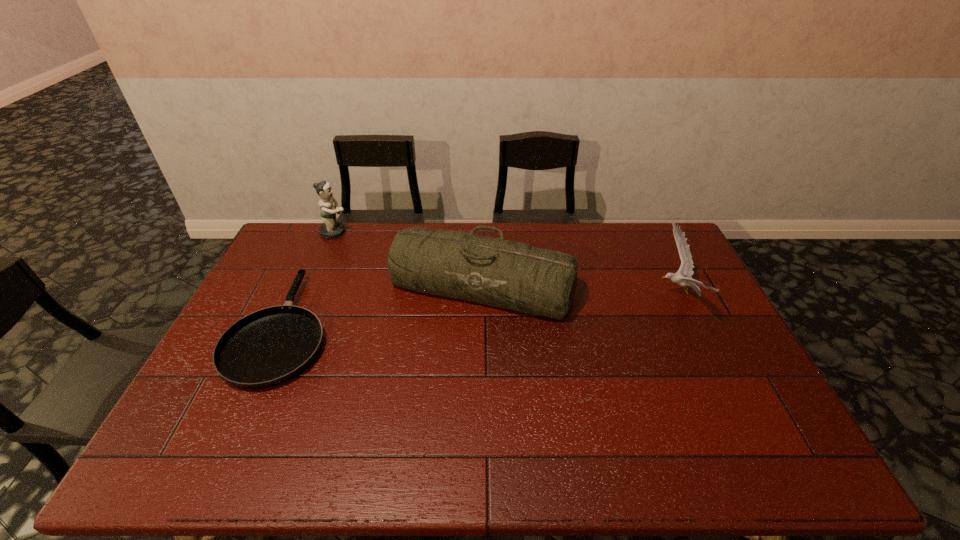
Find the location of `figurine`. figurine is located at coordinates (330, 229).

Identify the location of the second object from right to left. (512, 275).

At what (x,y) coordinates should I click in order to perform the action: click on gull. Please return your answer as a coordinate pair (x, y). The height and width of the screenshot is (540, 960). Looking at the image, I should click on (683, 277).

In order to click on frying pan in this screenshot , I will do `click(268, 347)`.

What are the coordinates of `vacant space situated 0.170m on the front-facing side of the farthest object` in the screenshot? It's located at (394, 232).

Find the location of a particular element. The width and height of the screenshot is (960, 540). free space located 0.310m on the front of the duffel bag is located at coordinates (483, 416).

Where is `vacant space located 0.160m at the tip of the beak of the gull`? vacant space located 0.160m at the tip of the beak of the gull is located at coordinates (607, 294).

The width and height of the screenshot is (960, 540). Find the location of `free space located at the tip of the beak of the gull`. free space located at the tip of the beak of the gull is located at coordinates (601, 294).

Locate an element on the screen. The width and height of the screenshot is (960, 540). free space located 0.290m at the tip of the beak of the gull is located at coordinates pyautogui.click(x=566, y=294).

Image resolution: width=960 pixels, height=540 pixels. I want to click on vacant area situated 0.250m on the handle side of the frying pan, so click(325, 235).